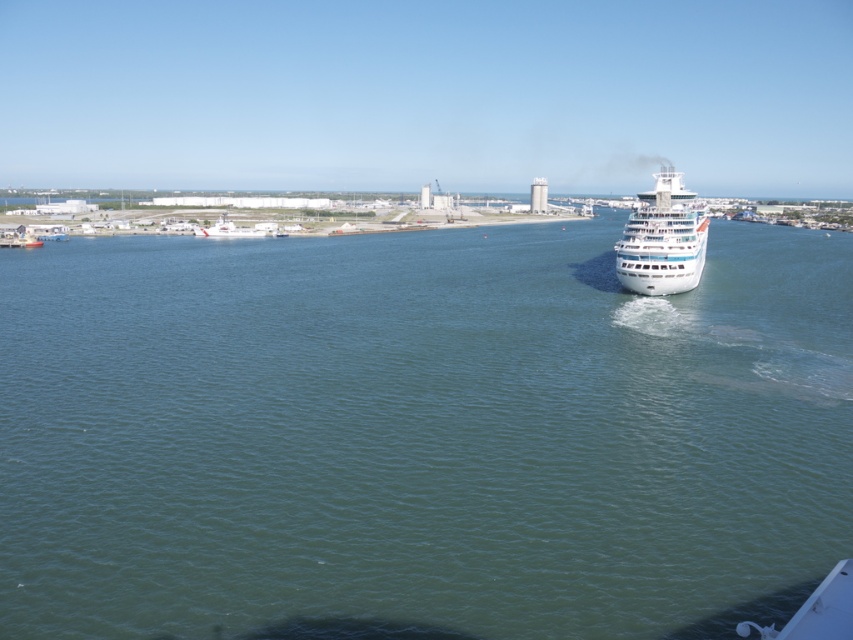
Can you confirm if green water at center is smaller than white glossy cruise ship at center?

Yes.

Who is taller, green water at center or white glossy cruise ship at center?

Standing taller between the two is white glossy cruise ship at center.

The image size is (853, 640). In order to click on green water at center in this screenshot , I will do `click(421, 435)`.